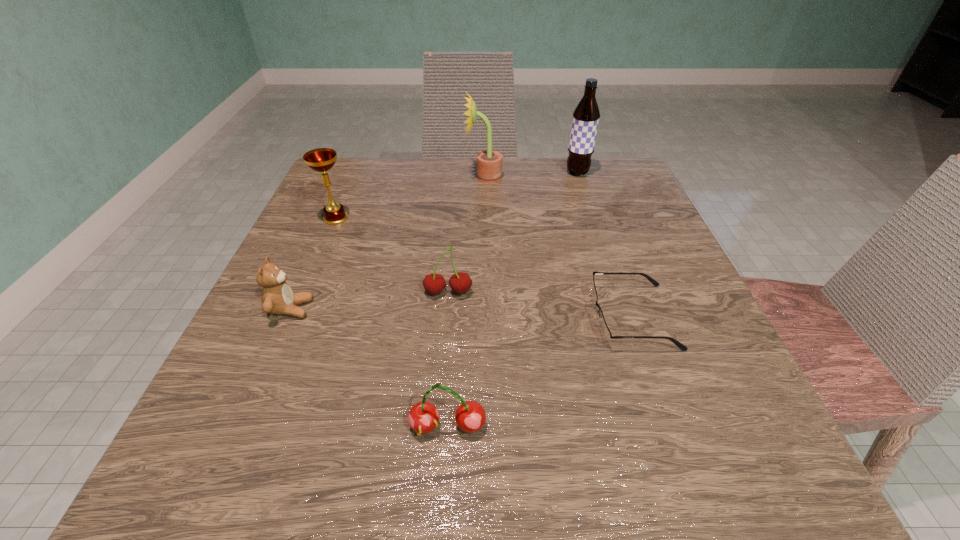
Find the location of a particular element. free location located on the face of the sunflower is located at coordinates (365, 177).

The width and height of the screenshot is (960, 540). I want to click on free space located on the face of the sunflower, so click(x=398, y=177).

In order to click on vacant space located on the front of the chalice in this screenshot , I will do `click(324, 245)`.

Find the location of a particular element. vacant space located on the surface of the farther cherry is located at coordinates coord(440,399).

Where is `vacant region located on the front-facing side of the teddy bear`? Image resolution: width=960 pixels, height=540 pixels. vacant region located on the front-facing side of the teddy bear is located at coordinates (408, 309).

Identify the location of vacant point located on the front-facing side of the spectacles. The width and height of the screenshot is (960, 540). (500, 317).

What are the coordinates of `free space located 0.240m on the front-facing side of the spectacles` in the screenshot? It's located at (444, 317).

You are a GUI agent. You are given a task and a screenshot of the screen. Output one action in this format:
    pyautogui.click(x=<x>, y=<y>)
    Task: Click on the vacant space located 0.380m on the front-facing side of the spectacles
    
    Given the screenshot: What is the action you would take?
    pyautogui.click(x=358, y=317)

Find the location of a particular element. Image resolution: width=960 pixels, height=540 pixels. root beer situated at the far edge is located at coordinates (586, 115).

The image size is (960, 540). In order to click on sunflower at the far edge in this screenshot , I will do `click(489, 163)`.